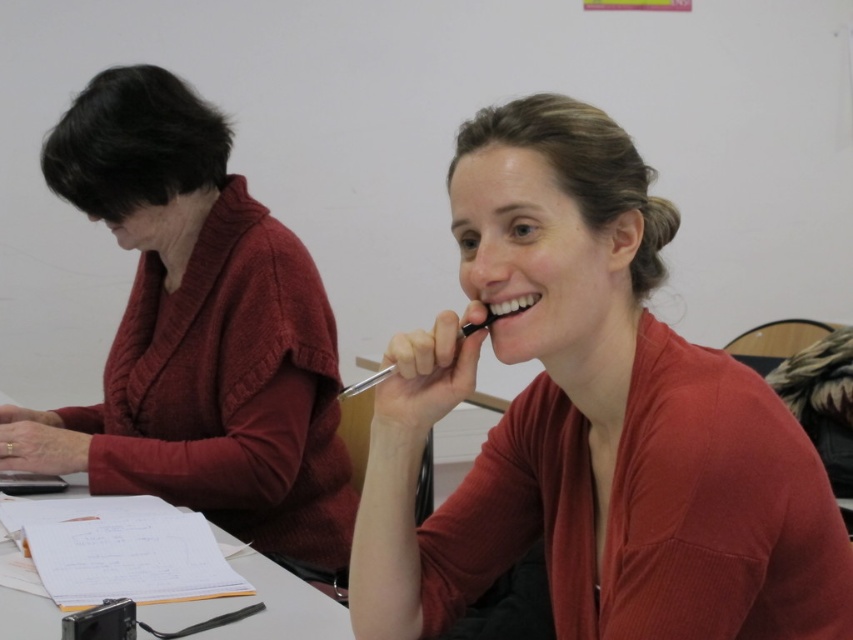
Question: Can you confirm if matte red sweater at center is smaller than matte red sweater at left?

Choices:
 (A) yes
 (B) no

Answer: (A)

Question: Is matte red sweater at center positioned behind white paper at center?

Choices:
 (A) yes
 (B) no

Answer: (B)

Question: Which point appears closest to the camera in this image?

Choices:
 (A) tap(308, 436)
 (B) tap(616, 625)
 (C) tap(33, 602)

Answer: (B)

Question: Is matte red sweater at left above white paper at center?

Choices:
 (A) yes
 (B) no

Answer: (A)

Question: Which object is positioned closest to the matte red sweater at center?

Choices:
 (A) matte red sweater at left
 (B) white paper at center

Answer: (B)

Question: Among these objects, which one is farthest from the camera?

Choices:
 (A) matte red sweater at left
 (B) white paper at center
 (C) matte red sweater at center

Answer: (A)